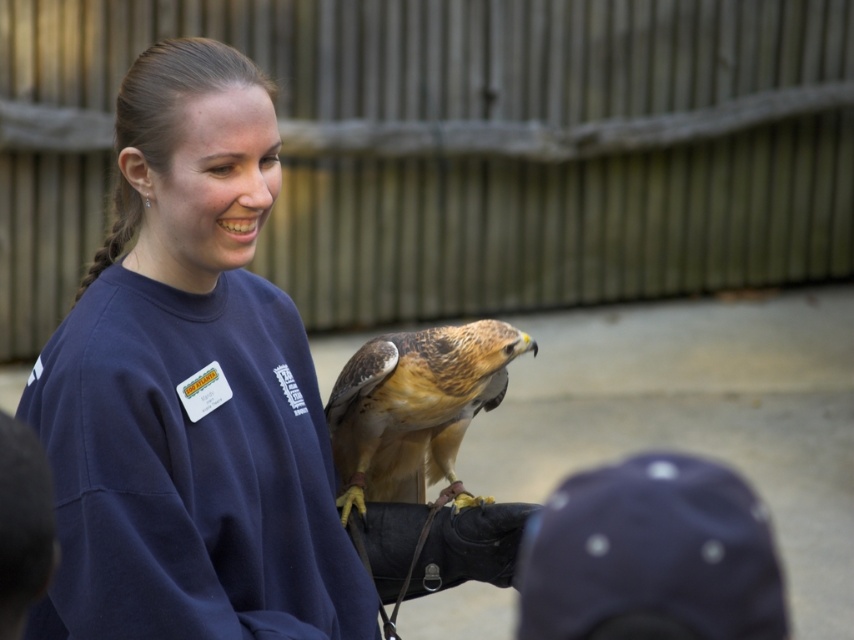
Question: Is navy blue sweatshirt at center to the left of brown feathered falcon at center from the viewer's perspective?

Choices:
 (A) no
 (B) yes

Answer: (B)

Question: Which point appears farthest from the camera in this image?

Choices:
 (A) [x=458, y=396]
 (B) [x=121, y=280]

Answer: (A)

Question: Can you confirm if navy blue sweatshirt at center is positioned to the right of brown feathered falcon at center?

Choices:
 (A) yes
 (B) no

Answer: (B)

Question: Can you confirm if navy blue sweatshirt at center is smaller than brown feathered falcon at center?

Choices:
 (A) no
 (B) yes

Answer: (A)

Question: Which object is farther from the camera taking this photo?

Choices:
 (A) navy blue sweatshirt at center
 (B) brown feathered falcon at center

Answer: (B)